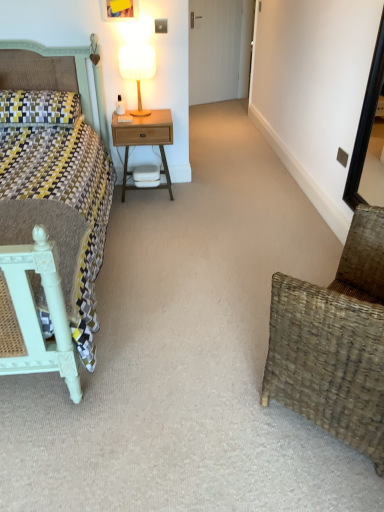
The height and width of the screenshot is (512, 384). I want to click on woodenmaterial/texturenightstand at center, so click(x=145, y=140).

This screenshot has width=384, height=512. What do you see at coordinates (335, 342) in the screenshot? I see `woven brown chair at lower right` at bounding box center [335, 342].

At what (x,y) coordinates should I click in order to perform the action: click on woven brown chair at lower right. Please return your answer as a coordinate pair (x, y). This screenshot has width=384, height=512. Looking at the image, I should click on (335, 342).

Where is `woodenmaterial/texturenightstand at center`? This screenshot has width=384, height=512. woodenmaterial/texturenightstand at center is located at coordinates (145, 140).

The height and width of the screenshot is (512, 384). Find the location of `chair that appears below the yellow and gray woven pillow at left (from a real-world perspective)`. chair that appears below the yellow and gray woven pillow at left (from a real-world perspective) is located at coordinates (335, 342).

From the image's perspective, which object appears higher, woven brown chair at lower right or yellow and gray woven pillow at left?

yellow and gray woven pillow at left is shown above in the image.

This screenshot has height=512, width=384. I want to click on glass door above the wooden table lamp at upper center (from the image's perspective), so click(x=214, y=50).

Considering the sizes of wooden table lamp at upper center and white glossy door at upper center in the image, is wooden table lamp at upper center bigger or smaller than white glossy door at upper center?

In the image, wooden table lamp at upper center appears to be smaller than white glossy door at upper center.

Is wooden table lamp at upper center next to white glossy door at upper center?

No, wooden table lamp at upper center is not with white glossy door at upper center.

From a real-world perspective, relative to white glossy door at upper center, is wooden table lamp at upper center vertically above or below?

In terms of real-world spatial position, wooden table lamp at upper center is above white glossy door at upper center.

Locate an element on the screen. bedside lamp behind the woven brown chair at lower right is located at coordinates (137, 68).

Is woven brown chair at lower right oriented towards wooden table lamp at upper center?

Yes, woven brown chair at lower right is oriented towards wooden table lamp at upper center.

How different are the orientations of woven brown chair at lower right and wooden table lamp at upper center in degrees?

There is a 137-degree angle between the facing directions of woven brown chair at lower right and wooden table lamp at upper center.

Does woven brown chair at lower right have a greater height compared to wooden table lamp at upper center?

Yes, woven brown chair at lower right is taller than wooden table lamp at upper center.

Between woodenmaterial/texturenightstand at center and yellow and gray woven pillow at left, which one is positioned in front?

yellow and gray woven pillow at left is more forward.

What's the angular difference between woodenmaterial/texturenightstand at center and yellow and gray woven pillow at left's facing directions?

There is a 0.645-degree angle between the facing directions of woodenmaterial/texturenightstand at center and yellow and gray woven pillow at left.

Considering the sizes of objects woodenmaterial/texturenightstand at center and yellow and gray woven pillow at left in the image provided, who is taller, woodenmaterial/texturenightstand at center or yellow and gray woven pillow at left?

woodenmaterial/texturenightstand at center.

Measure the distance from wooden table lamp at upper center to yellow and gray woven pillow at left.

wooden table lamp at upper center and yellow and gray woven pillow at left are 23.07 inches apart from each other.

From the image's perspective, which one is positioned higher, wooden table lamp at upper center or yellow and gray woven pillow at left?

wooden table lamp at upper center is shown above in the image.

Can you see wooden table lamp at upper center touching yellow and gray woven pillow at left?

No, wooden table lamp at upper center is not in contact with yellow and gray woven pillow at left.

Is yellow and gray woven pillow at left completely or partially inside wooden table lamp at upper center?

Actually, yellow and gray woven pillow at left is outside wooden table lamp at upper center.

Is matte green bed at left turned away from wooden table lamp at upper center?

No, wooden table lamp at upper center is not at the back of matte green bed at left.

From a real-world perspective, is matte green bed at left on top of wooden table lamp at upper center?

No.

Is matte green bed at left with wooden table lamp at upper center?

No, matte green bed at left is not making contact with wooden table lamp at upper center.

Is white glossy door at upper center turned away from matte green bed at left?

No, white glossy door at upper center is not facing the opposite direction of matte green bed at left.

In the scene shown: From a real-world perspective, which object rests below the other?

From a 3D spatial view, matte green bed at left is below.

Is white glossy door at upper center surrounding matte green bed at left?

No.

Would you say white glossy door at upper center is a long distance from matte green bed at left?

Yes, white glossy door at upper center and matte green bed at left are quite far apart.

Locate an element on the screen. This screenshot has height=512, width=384. chair below the yellow and gray woven pillow at left (from a real-world perspective) is located at coordinates (335, 342).

This screenshot has width=384, height=512. I want to click on bedside lamp in front of the white glossy door at upper center, so click(137, 68).

Estimate the real-world distances between objects in this image. Which object is closer to woodenmaterial/texturenightstand at center, woven brown chair at lower right or matte green bed at left?

The object closer to woodenmaterial/texturenightstand at center is matte green bed at left.

Estimate the real-world distances between objects in this image. Which object is closer to woodenmaterial/texturenightstand at center, matte green bed at left or wooden table lamp at upper center?

wooden table lamp at upper center is closer to woodenmaterial/texturenightstand at center.

Estimate the real-world distances between objects in this image. Which object is further from yellow and gray woven pillow at left, white glossy door at upper center or matte green bed at left?

Among the two, white glossy door at upper center is located further to yellow and gray woven pillow at left.

When comparing their distances from woven brown chair at lower right, does black wooden mirror at right or matte green bed at left seem closer?

matte green bed at left.

Based on the photo, which object lies further to the anchor point white glossy door at upper center, wooden table lamp at upper center or woven brown chair at lower right?

woven brown chair at lower right is positioned further to the anchor white glossy door at upper center.

From the image, which object appears to be nearer to matte green bed at left, yellow and gray woven pillow at left or black wooden mirror at right?

yellow and gray woven pillow at left lies closer to matte green bed at left than the other object.

Looking at the image, which one is located further to woven brown chair at lower right, woodenmaterial/texturenightstand at center or yellow and gray woven pillow at left?

Based on the image, yellow and gray woven pillow at left appears to be further to woven brown chair at lower right.

Looking at this image, estimate the real-world distances between objects in this image. Which object is closer to black wooden mirror at right, woven brown chair at lower right or white glossy door at upper center?

The object closer to black wooden mirror at right is woven brown chair at lower right.

At what (x,y) coordinates should I click in order to perform the action: click on bedside lamp between black wooden mirror at right and white glossy door at upper center from front to back. Please return your answer as a coordinate pair (x, y). The height and width of the screenshot is (512, 384). Looking at the image, I should click on (137, 68).

At what (x,y) coordinates should I click in order to perform the action: click on pillow between matte green bed at left and wooden table lamp at upper center in the front-back direction. Please return your answer as a coordinate pair (x, y). The image size is (384, 512). Looking at the image, I should click on pos(38,108).

I want to click on bed between yellow and gray woven pillow at left and woven brown chair at lower right, so click(50, 205).

Identify the location of chair between yellow and gray woven pillow at left and black wooden mirror at right. (335, 342).